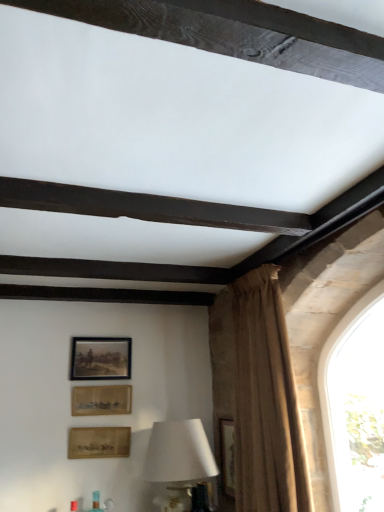
Question: Is brown textured curtain at right to the right of wooden frame at upper center, which is counted as the 1th picture frame, starting from the top, from the viewer's perspective?

Choices:
 (A) yes
 (B) no

Answer: (A)

Question: Is brown textured curtain at right aimed at wooden frame at upper center, which is counted as the third picture frame, starting from the bottom?

Choices:
 (A) no
 (B) yes

Answer: (A)

Question: Is brown textured curtain at right surrounding wooden frame at upper center, which is counted as the third picture frame, starting from the bottom?

Choices:
 (A) yes
 (B) no

Answer: (B)

Question: From a real-world perspective, is brown textured curtain at right positioned under wooden frame at upper center, which is counted as the 1th picture frame, starting from the top, based on gravity?

Choices:
 (A) no
 (B) yes

Answer: (B)

Question: Does brown textured curtain at right have a smaller size compared to wooden frame at upper center, which is counted as the third picture frame, starting from the bottom?

Choices:
 (A) no
 (B) yes

Answer: (A)

Question: Considering the positions of white matte table lamp at lower center and wooden framed picture at lower center, which is counted as the 1th picture frame, starting from the bottom, in the image, is white matte table lamp at lower center taller or shorter than wooden framed picture at lower center, which is counted as the 1th picture frame, starting from the bottom,?

Choices:
 (A) tall
 (B) short

Answer: (A)

Question: From the image's perspective, is white matte table lamp at lower center positioned above or below wooden framed picture at lower center, which is counted as the 1th picture frame, starting from the bottom?

Choices:
 (A) above
 (B) below

Answer: (B)

Question: Based on their sizes in the image, would you say white matte table lamp at lower center is bigger or smaller than wooden framed picture at lower center, which is counted as the 1th picture frame, starting from the bottom?

Choices:
 (A) big
 (B) small

Answer: (A)

Question: Looking at their shapes, would you say white matte table lamp at lower center is wider or thinner than wooden framed picture at lower center, the third picture frame viewed from the top?

Choices:
 (A) wide
 (B) thin

Answer: (A)

Question: Based on their sizes in the image, would you say brown textured curtain at right is bigger or smaller than wooden framed picture at lower center, which is counted as the 1th picture frame, starting from the bottom?

Choices:
 (A) small
 (B) big

Answer: (B)

Question: Would you say brown textured curtain at right is inside or outside wooden framed picture at lower center, which is counted as the 1th picture frame, starting from the bottom?

Choices:
 (A) outside
 (B) inside

Answer: (A)

Question: In the image, is brown textured curtain at right on the left side or the right side of wooden framed picture at lower center, the third picture frame viewed from the top?

Choices:
 (A) right
 (B) left

Answer: (A)

Question: Is brown textured curtain at right taller or shorter than wooden framed picture at lower center, which is counted as the 1th picture frame, starting from the bottom?

Choices:
 (A) short
 (B) tall

Answer: (B)

Question: Based on their sizes in the image, would you say wooden framed picture at lower center, which is counted as the 1th picture frame, starting from the bottom, is bigger or smaller than brown textured curtain at right?

Choices:
 (A) big
 (B) small

Answer: (B)

Question: Visually, is wooden framed picture at lower center, the third picture frame viewed from the top, positioned to the left or to the right of brown textured curtain at right?

Choices:
 (A) left
 (B) right

Answer: (A)